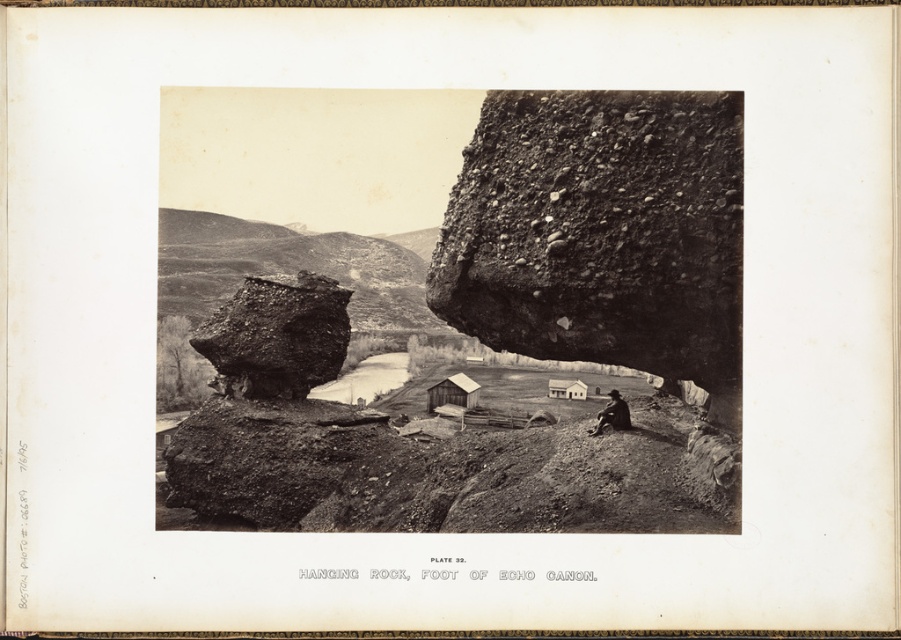
Question: Can you confirm if dark brown leather jacket at lower right is smaller than white wooden hut at center?

Choices:
 (A) yes
 (B) no

Answer: (A)

Question: Which point is farther from the camera taking this photo?

Choices:
 (A) (583, 106)
 (B) (598, 419)
 (C) (440, 387)

Answer: (C)

Question: Which of the following is the farthest from the observer?

Choices:
 (A) rough textured rock at center
 (B) rusty stone rock at center-left
 (C) dark brown leather jacket at lower right

Answer: (B)

Question: Which point is farther to the camera?

Choices:
 (A) (521, 90)
 (B) (553, 381)
 (C) (248, 291)
 (D) (620, 417)

Answer: (B)

Question: Can you confirm if dark brown leather jacket at lower right is smaller than white wooden hut at center?

Choices:
 (A) no
 (B) yes

Answer: (B)

Question: Can you confirm if rusty stone rock at center-left is wider than dark brown leather jacket at lower right?

Choices:
 (A) yes
 (B) no

Answer: (A)